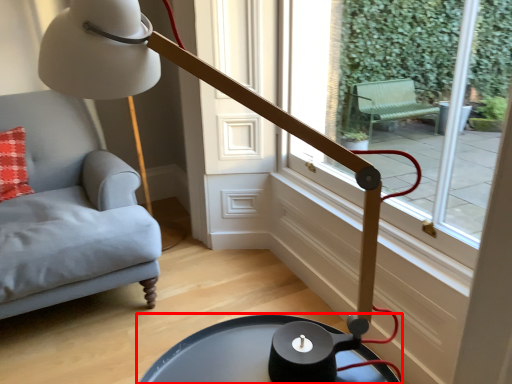
Question: In this image, where is table (annotated by the red box) located relative to window?

Choices:
 (A) left
 (B) right

Answer: (A)